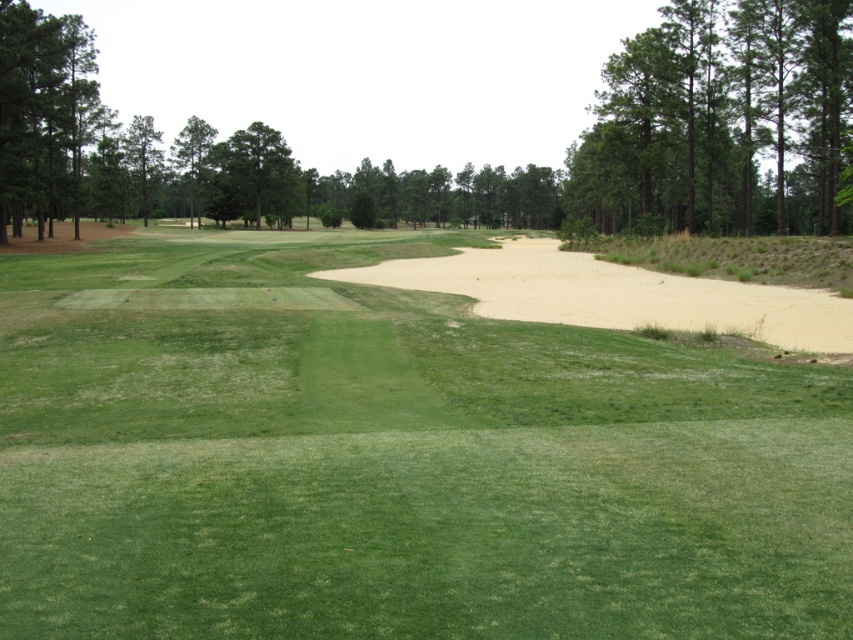
You are a golfer standing on the fairway and looking towards the putting green. You notice two trees in the distance. Which tree is further to the right, the green leafy tree at upper right or the green leafy tree at upper center?

The green leafy tree at upper right is positioned on the right side of green leafy tree at upper center, so it is further to the right.

You are a golfer standing on the fairway and see the tan sandy bunker at center and the green leafy tree at upper left. Which object is closer to you?

The tan sandy bunker at center is closer to you because it is in front of the green leafy tree at upper left, meaning the tree is further away.